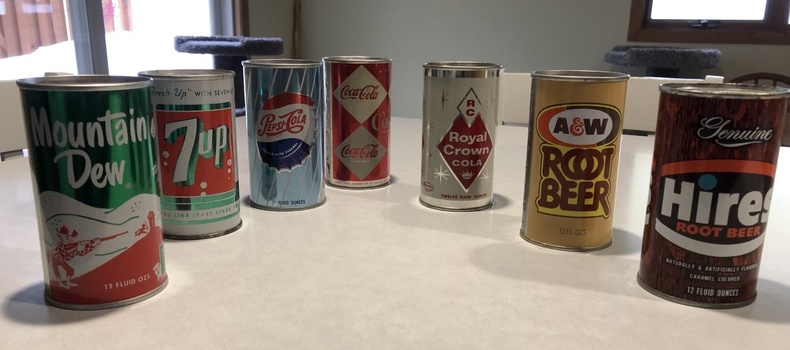
Where is `bare gray far wall space`? This screenshot has height=350, width=790. bare gray far wall space is located at coordinates (431, 32).